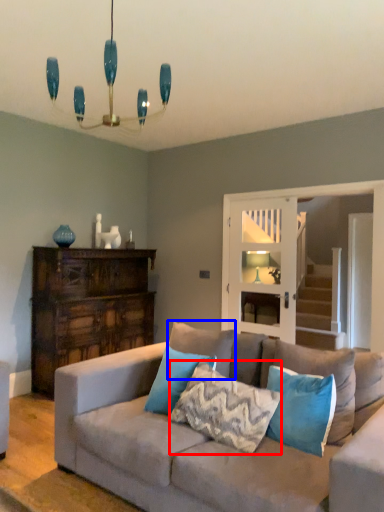
Question: Which of the following is the closest to the observer, pillow (highlighted by a red box) or pillow (highlighted by a blue box)?

Choices:
 (A) pillow
 (B) pillow

Answer: (A)